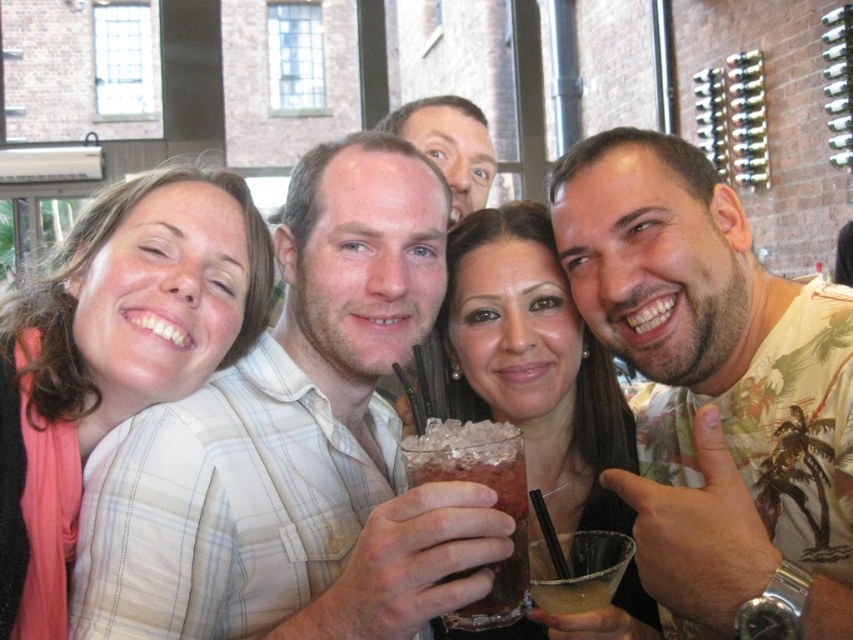
Question: Which of the following is the closest to the observer?

Choices:
 (A) (141, 320)
 (B) (479, 188)
 (C) (561, 611)

Answer: (C)

Question: Which point is closer to the camera?

Choices:
 (A) translucent glass drink at lower right
 (B) clear glass drink at center
 (C) beige tropical shirt at center
 (D) light blue plaid shirt at center

Answer: (C)

Question: Is clear glass drink at center to the right of smooth skin face at upper center from the viewer's perspective?

Choices:
 (A) no
 (B) yes

Answer: (B)

Question: Considering the real-world distances, which object is farthest from the translucent glass cocktail at lower right?

Choices:
 (A) beige tropical shirt at center
 (B) light blue plaid shirt at center
 (C) smooth skin face at upper center

Answer: (C)

Question: Does beige tropical shirt at center have a smaller size compared to clear glass drink at center?

Choices:
 (A) no
 (B) yes

Answer: (A)

Question: Where is light blue plaid shirt at center located in relation to smooth skin face at upper center in the image?

Choices:
 (A) right
 (B) left

Answer: (B)